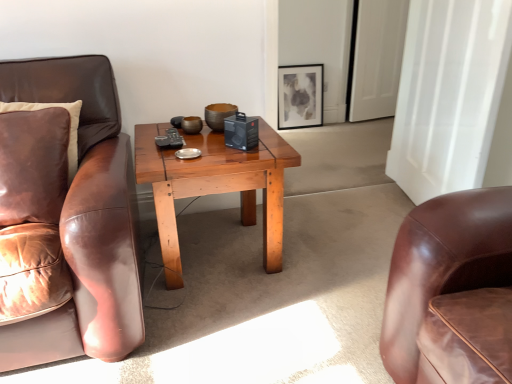
What are the coordinates of `vacant space in wooden coffee table at center (from a real-world perspective)` in the screenshot? It's located at (216, 254).